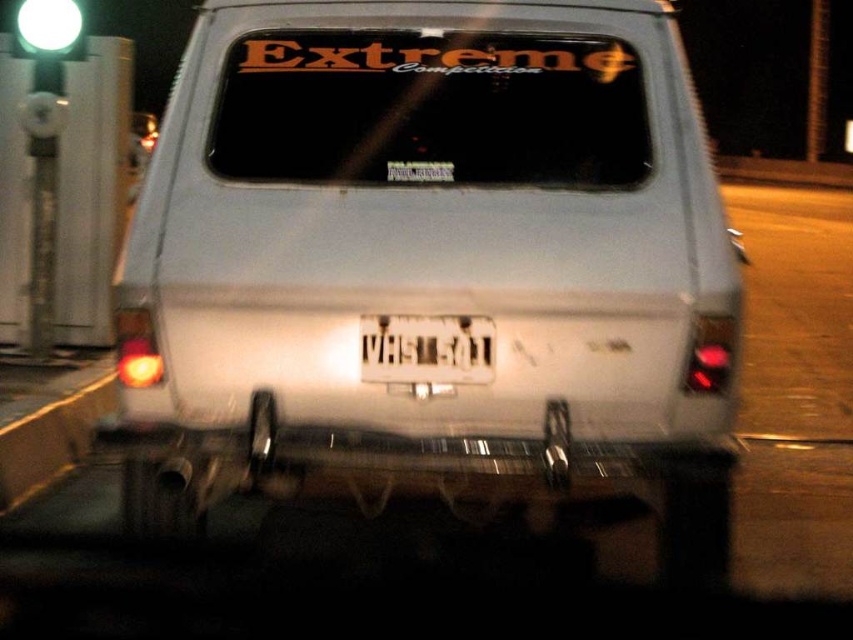
Consider the image. A drone is flying at night and needs to land on the point at coordinates point (607, 124). The drone has a maximum landing distance of 3 meters. Can it safely land there?

The distance between the drone and the point (607, 124) is 3.52 meters, which exceeds the drone maximum landing distance of 3 meters. Therefore, the drone cannot safely land there.

You are a security guard inspecting a parking lot at night. You notice a white matte van at center and a white plastic license plate at center. Which object is nearer to you?

The white matte van at center is closer to the viewer than the white plastic license plate at center.

You are a delivery driver who needs to attach a magnetic sign to the white matte van at center. The sign requires a minimum of 18 inches of space to avoid interfering with the white plastic license plate at center. Based on the image, will the sign fit without overlapping the license plate?

The distance between the white matte van at center and the white plastic license plate at center is 17.66 inches. Since this is less than the required 18 inches, the magnetic sign will overlap the license plate and cannot be safely attached without interference.